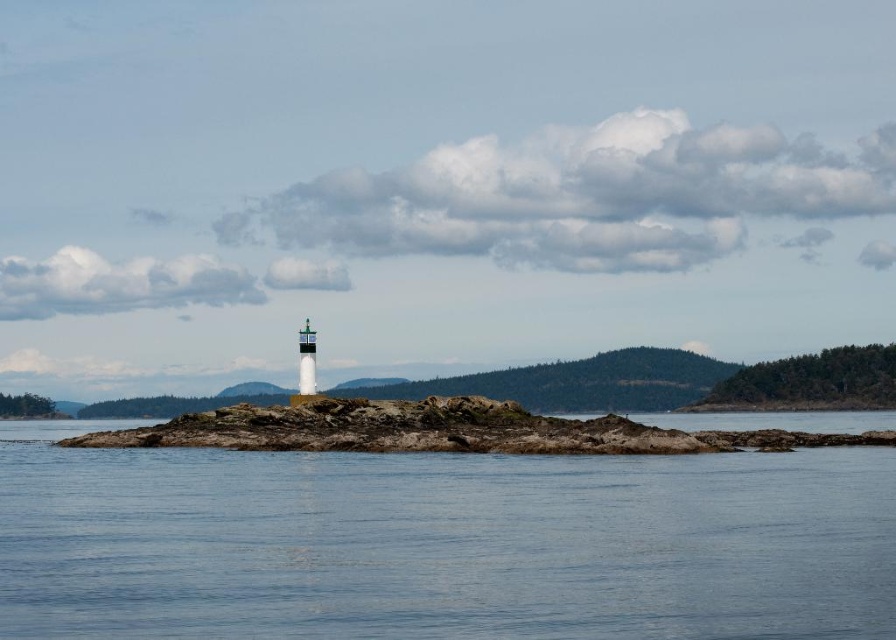
Is point (168, 516) closer to camera compared to point (394, 403)?

Yes, point (168, 516) is in front of point (394, 403).

Does clear blue water at center have a greater height compared to rugged stone island at center?

Yes, clear blue water at center is taller than rugged stone island at center.

Who is more distant from viewer, (886, 628) or (289, 442)?

Point (289, 442)

Where is `clear blue water at center`? The image size is (896, 640). clear blue water at center is located at coordinates (440, 544).